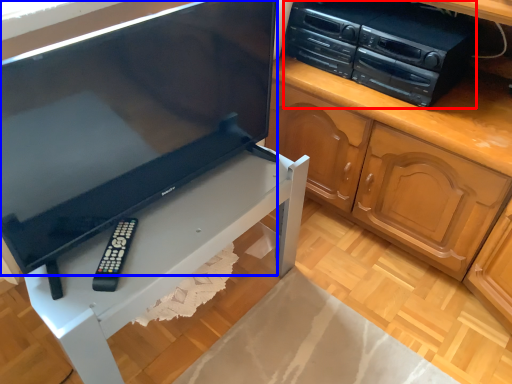
Question: Which of the following is the farthest to the observer, home appliance (highlighted by a red box) or television (highlighted by a blue box)?

Choices:
 (A) home appliance
 (B) television

Answer: (A)